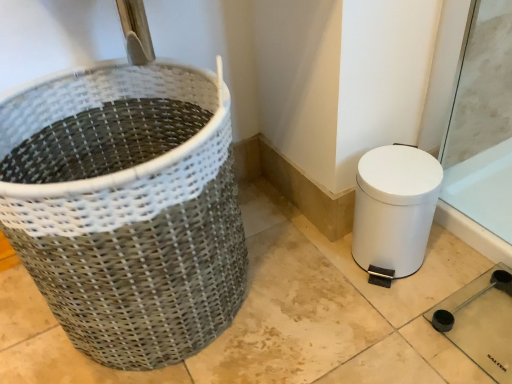
You are a GUI agent. You are given a task and a screenshot of the screen. Output one action in this format:
    pyautogui.click(x=<x>, y=<y>)
    Task: Click on the vacant space that's between natural woven basket at left and white matte toilet bowl at lower right
    
    Given the screenshot: What is the action you would take?
    pyautogui.click(x=294, y=276)